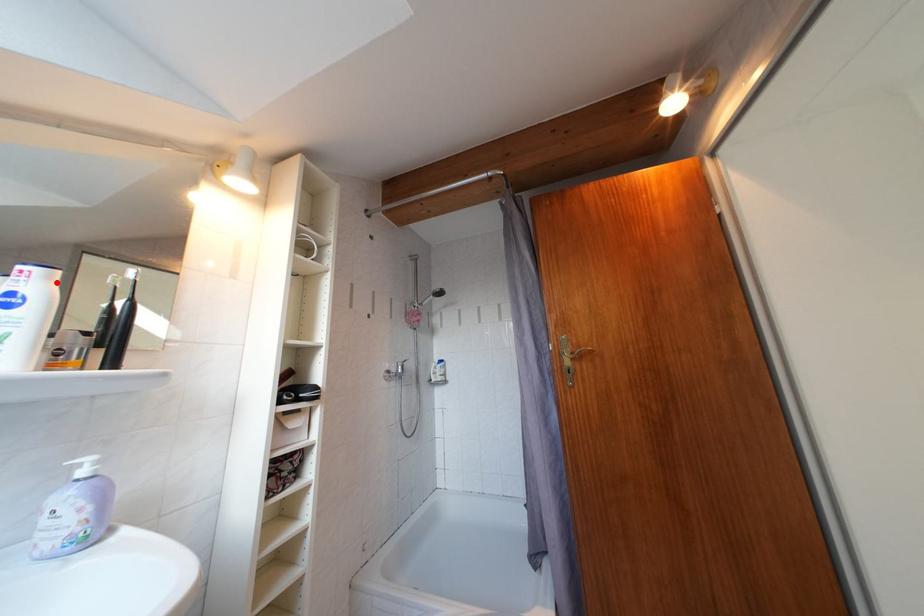
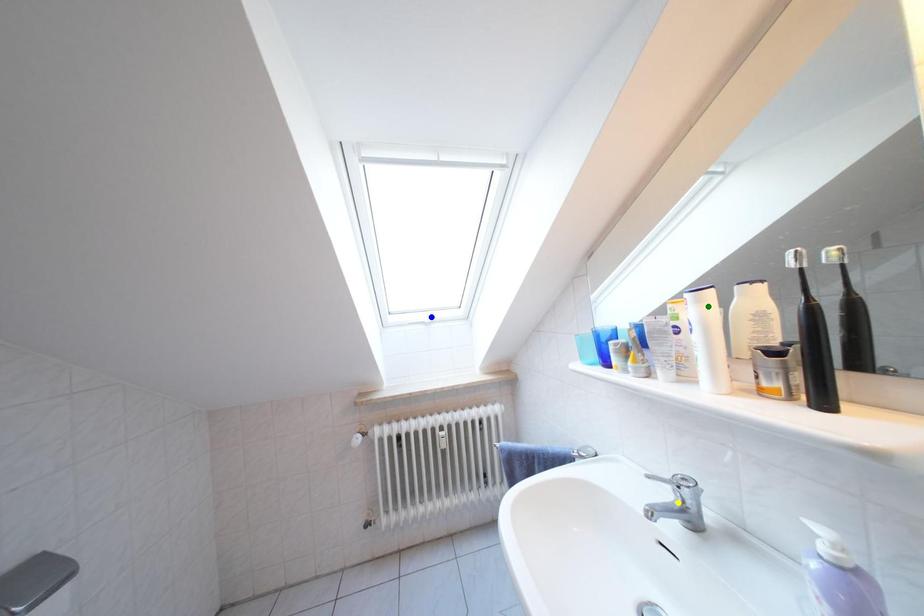
Question: I am providing you with two images of the same scene from different viewpoints. A red point is marked on the first image. You are given multiple points on the second image. Which point in image 2 represents the same 3d spot as the red point in image 1?

Choices:
 (A) green point
 (B) yellow point
 (C) blue point

Answer: (A)